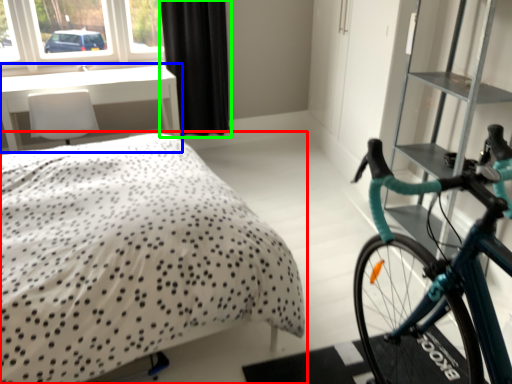
Question: Considering the real-world distances, which object is closest to bed (highlighted by a red box)? table (highlighted by a blue box) or curtain (highlighted by a green box).

Choices:
 (A) table
 (B) curtain

Answer: (A)